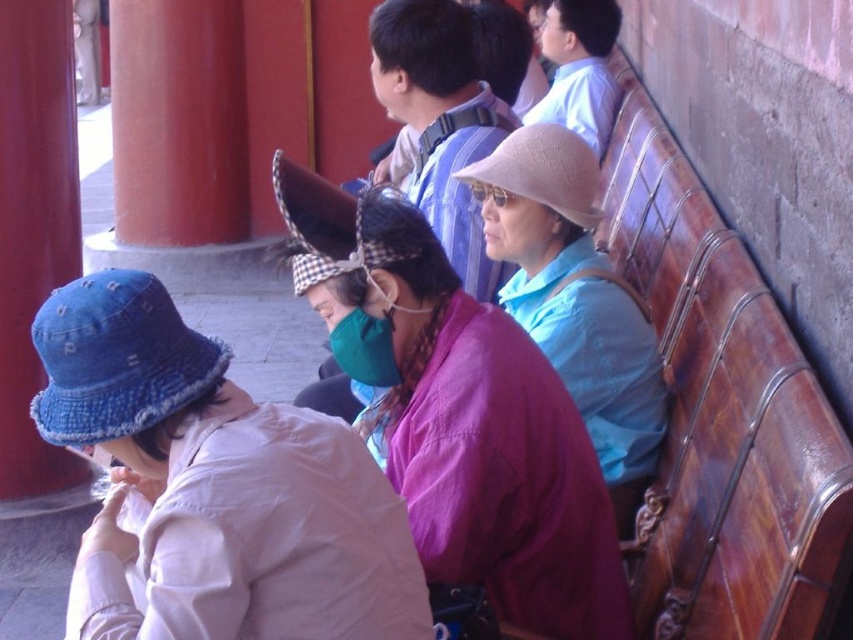
You are a photographer trying to capture a shot of the two hats. Since you want both hats in the frame, which direction should you move your camera to include both the denim hat at lower left and the light beige straw hat at center?

The denim hat at lower left is to the left of the light beige straw hat at center, so you should move your camera to the left to include both hats in the frame.

You are standing at the center of the image and want to place a small potted plant exactly at point [213,486]. However, there is an object already present there. What is the object located at that point?

The object located at point [213,486] is the denim hat at lower left.

You are standing in front of the bench and want to compare the height of the denim hat at lower left and the smooth red pillar at left. Which one is taller?

The smooth red pillar at left is taller than the denim hat at lower left.